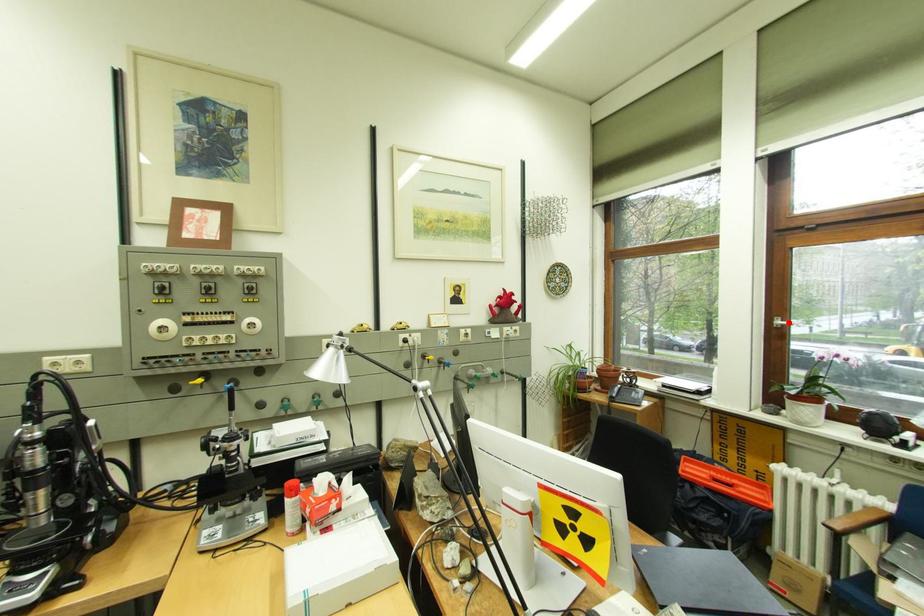
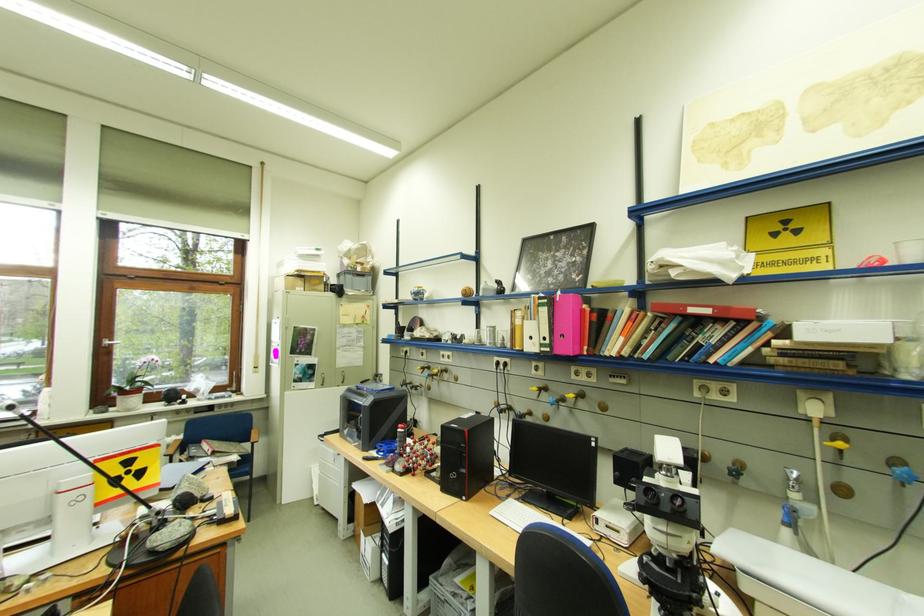
Question: I am providing you with two images of the same scene from different viewpoints. A red point is marked on the first image. Can you still see the location of the red point in image 2?

Choices:
 (A) Yes
 (B) No

Answer: (A)